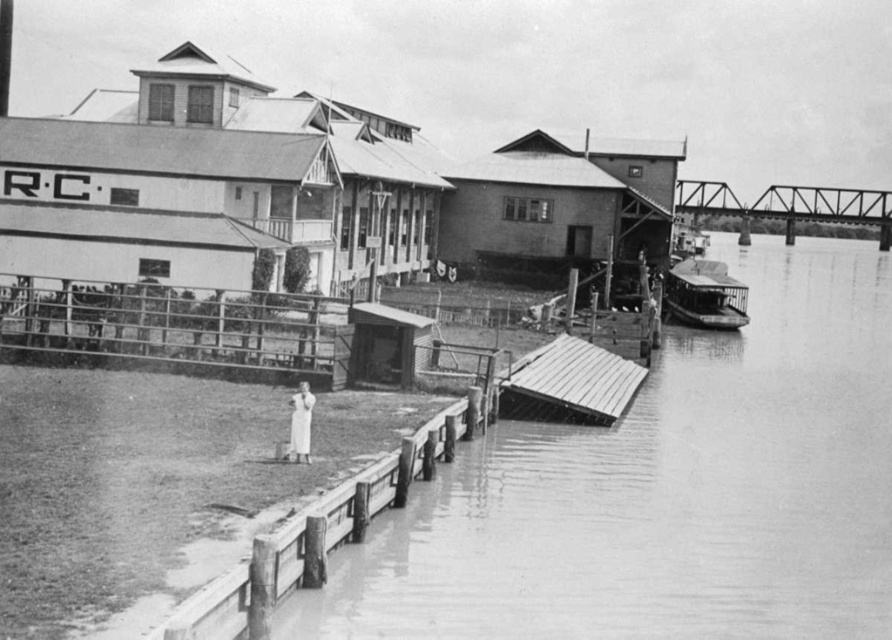
Looking at this image, you are a photographer trying to capture the metallic gray dock at lower center and the white cotton dress at lower left in the same frame. Based on their positions, can you fit both objects into your camera view without moving the camera? Explain your reasoning.

The metallic gray dock at lower center might be wider than the white cotton dress at lower left, so it depends on the camera view size. If the camera view can accommodate the width of the metallic gray dock at lower center, then both objects can be included. However, if the dock is too wide, adjusting the angle or using a wider lens might be necessary.

You are a photographer planning to capture the entire smooth concrete dock at lower center and the smooth wooden boat at right in a single frame. Given their sizes, which object should you position closer to the camera to ensure both fit in the frame?

The smooth concrete dock at lower center is larger than the smooth wooden boat at right, so to fit both in the frame, position the smooth wooden boat at right closer to the camera.